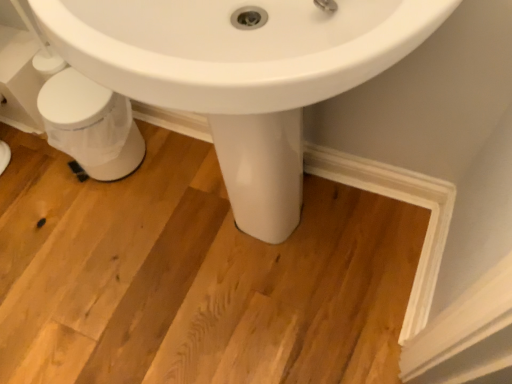
Where is `free point to the right of white plastic trash can at lower left`? Image resolution: width=512 pixels, height=384 pixels. free point to the right of white plastic trash can at lower left is located at coordinates (172, 167).